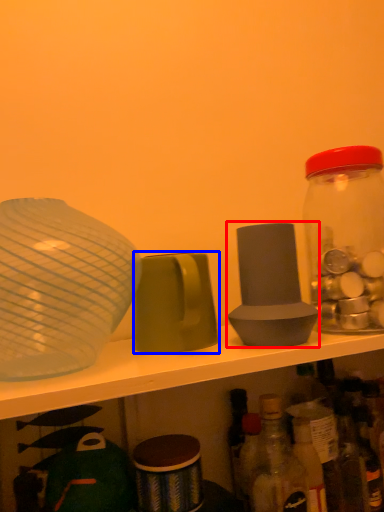
Question: Which point is further to the camera, tableware (highlighted by a red box) or tableware (highlighted by a blue box)?

Choices:
 (A) tableware
 (B) tableware

Answer: (A)